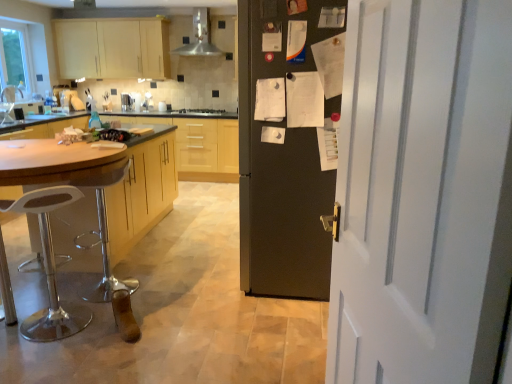
Question: Which is correct: metallic stainless steel range hood at upper center is inside white painted wood door at right, or outside of it?

Choices:
 (A) outside
 (B) inside

Answer: (A)

Question: Is metallic stainless steel range hood at upper center in front of or behind white painted wood door at right in the image?

Choices:
 (A) front
 (B) behind

Answer: (B)

Question: Considering the real-world distances, which object is farthest from the white plastic bar stool at left?

Choices:
 (A) wooden cabinet at center, which is the 1th cabinetry from front to back
 (B) satin silver coffee machine at center
 (C) metallic stainless steel range hood at upper center
 (D) white painted wood door at right
 (E) black matte stove at center

Answer: (C)

Question: Which of these objects is positioned farthest from the matte black fridge at center?

Choices:
 (A) matte wood cabinets at upper left, which is the first cabinetry from top to bottom
 (B) satin silver coffee machine at center
 (C) black matte stove at center
 (D) metallic stainless steel range hood at upper center
 (E) wooden cabinet at center, which is the 2th cabinetry from top to bottom

Answer: (A)